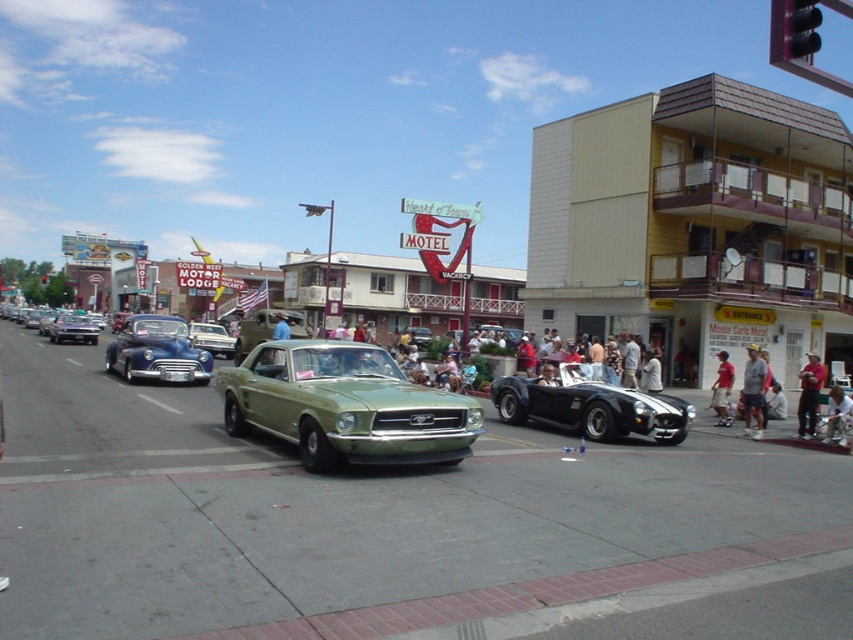
Question: Is shiny blue car at left further to camera compared to light brown leather jacket at lower right?

Choices:
 (A) no
 (B) yes

Answer: (B)

Question: Which of the following is the farthest from the observer?

Choices:
 (A) black plastic traffic light at upper right
 (B) light brown leather shorts at lower right
 (C) gray fabric cap at lower right

Answer: (B)

Question: Which point is farther to the camera?

Choices:
 (A) matte green car at center
 (B) shiny blue car at left

Answer: (A)

Question: Considering the relative positions of light brown leather jacket at lower right and matte green car at center in the image provided, where is light brown leather jacket at lower right located with respect to matte green car at center?

Choices:
 (A) below
 (B) above

Answer: (A)

Question: Does shiny blue car at left have a larger size compared to black plastic traffic light at upper right?

Choices:
 (A) no
 (B) yes

Answer: (B)

Question: Which of the following is the farthest from the observer?

Choices:
 (A) shiny blue car at left
 (B) red shirt at center

Answer: (A)